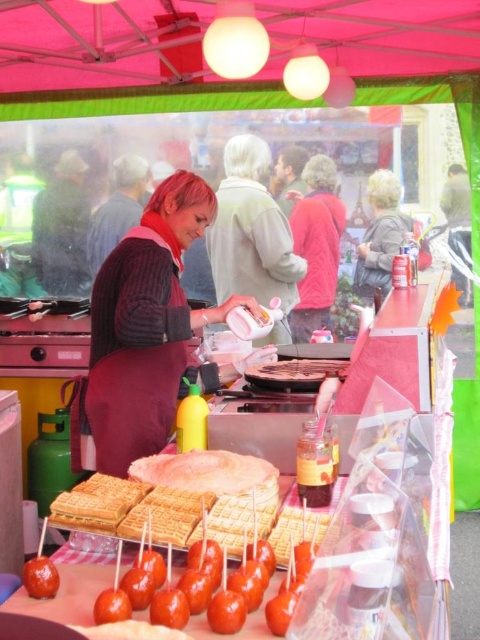
You are a customer at the market and want to know if the gray woolen sweater at upper right can be seen above the glossy caramel apple at lower left. Based on their positions, can you confirm this?

The gray woolen sweater at upper right is taller than the glossy caramel apple at lower left, so yes, the sweater can be seen above the caramel apple.

You are a customer at the market and want to buy both the gray woolen sweater at upper right and the chocolate cake at center. However, your bag can only carry one item. Based on their sizes, which item should you choose to fit in your bag?

The gray woolen sweater at upper right is larger in size than chocolate cake at center, so you should choose the chocolate cake at center to fit in your bag.